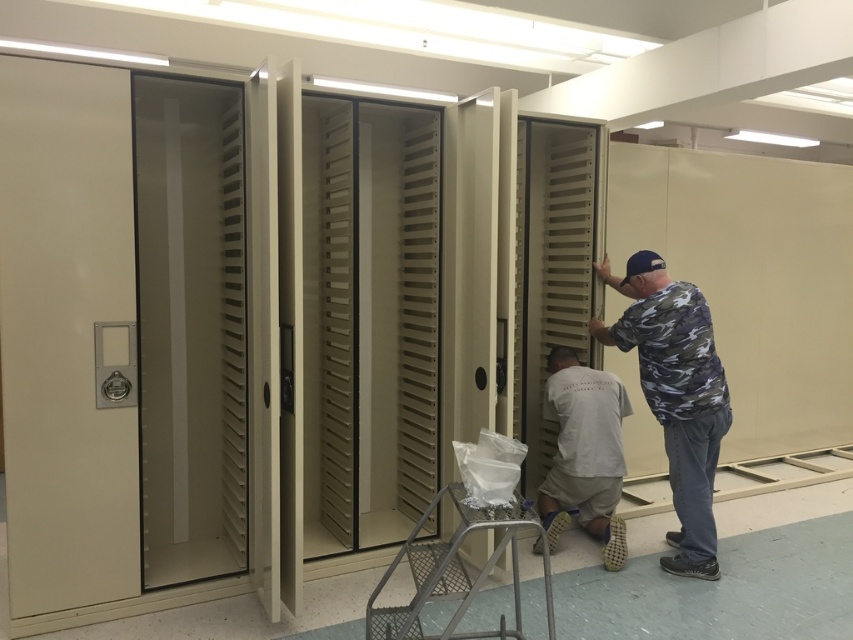
Question: Which object is positioned closest to the matte beige cabinet at center?

Choices:
 (A) white cotton shirt at center
 (B) camo shirt at right

Answer: (A)

Question: Is matte beige cabinet at center thinner than camo shirt at right?

Choices:
 (A) yes
 (B) no

Answer: (B)

Question: Among these points, which one is farthest from the camera?

Choices:
 (A) (689, 340)
 (B) (311, 422)
 (C) (556, 396)

Answer: (B)

Question: From the image, what is the correct spatial relationship of camo shirt at right in relation to white cotton shirt at center?

Choices:
 (A) right
 (B) left

Answer: (A)

Question: Does camo shirt at right come in front of white cotton shirt at center?

Choices:
 (A) yes
 (B) no

Answer: (A)

Question: Which object appears closest to the camera in this image?

Choices:
 (A) camo shirt at right
 (B) matte beige cabinet at center

Answer: (B)